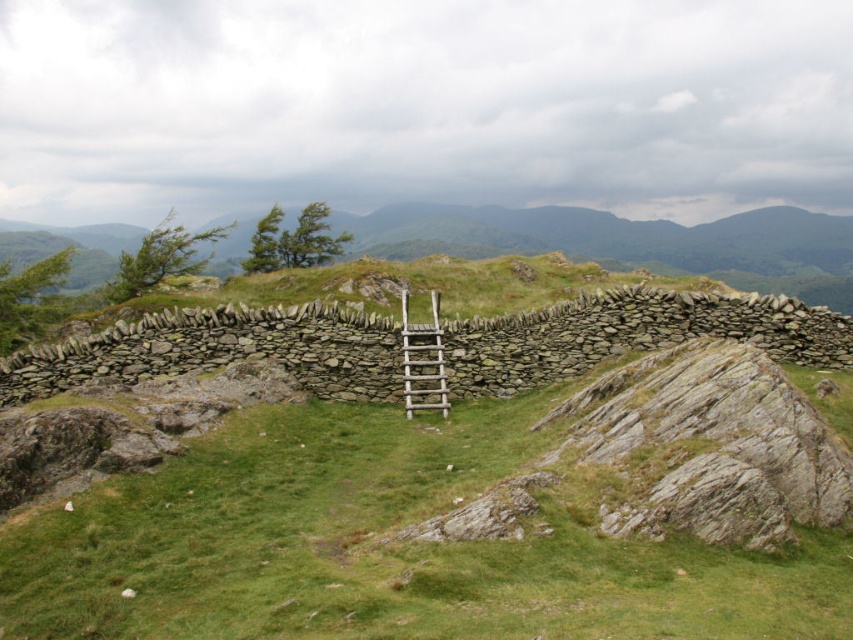
Question: Observing the image, what is the correct spatial positioning of green grassy at center in reference to wooden ladder at center?

Choices:
 (A) right
 (B) left

Answer: (A)

Question: Which object is farther from the camera taking this photo?

Choices:
 (A) wooden ladder at center
 (B) green grassy at center

Answer: (A)

Question: Observing the image, what is the correct spatial positioning of green grassy at center in reference to wooden ladder at center?

Choices:
 (A) left
 (B) right

Answer: (B)

Question: Is green grassy at center positioned at the back of wooden ladder at center?

Choices:
 (A) no
 (B) yes

Answer: (A)

Question: Which point is closer to the camera?

Choices:
 (A) (627, 557)
 (B) (405, 403)

Answer: (A)